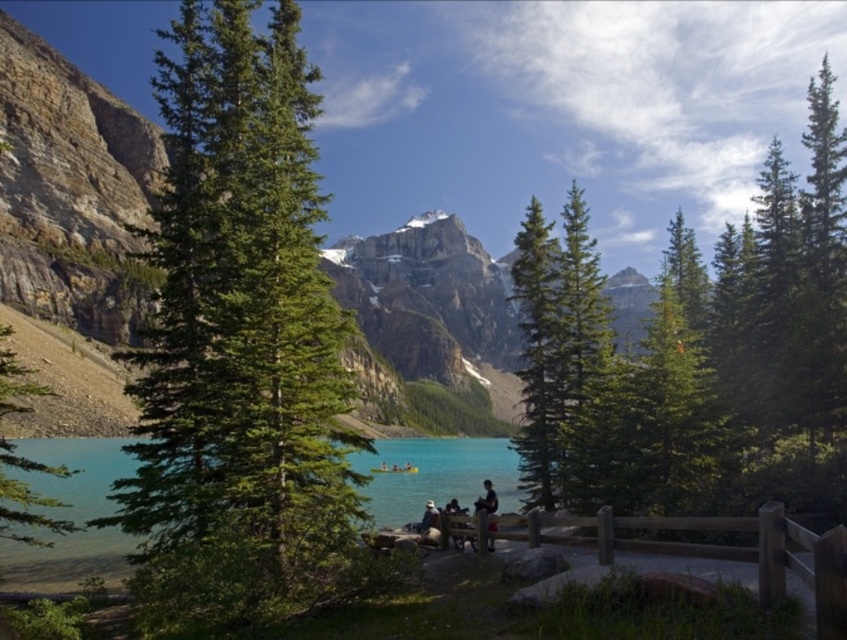
You are standing at the edge of the lake and want to take a photo of the green matte tree at center. If your camera has a maximum zoom range of 100 feet, can you capture the tree in full without moving closer?

The green matte tree at center and viewer are 343.08 feet apart from each other. Since the camera can only zoom up to 100 feet, you cannot capture the tree in full without moving closer.

Based on the provided coordinates, where exactly is the green matte tree at upper center located in the image?

The green matte tree at upper center is located at the coordinates point (698, 355).

You are standing at the edge of the rocky outcrop and want to sit down on either the green matte tree at center or the light brown wooden bench at lower center. Which one is closer to you?

The light brown wooden bench at lower center is closer to you because the green matte tree at center is further away.